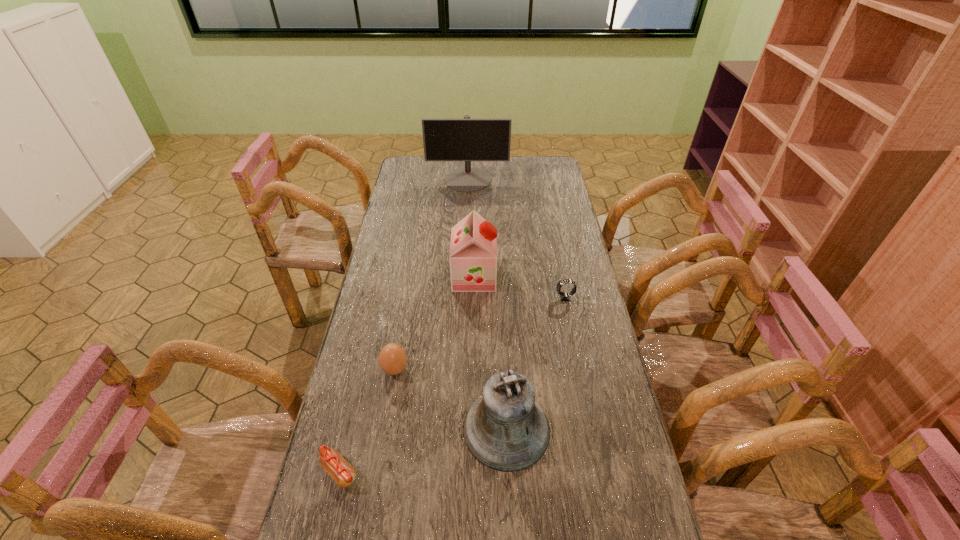
Identify the location of free spot between the watch and the second farthest object. (519, 287).

You are a GUI agent. You are given a task and a screenshot of the screen. Output one action in this format:
    pyautogui.click(x=<x>, y=<y>)
    Task: Click on the vacant space that is in between the watch and the soya milk
    
    Given the screenshot: What is the action you would take?
    pyautogui.click(x=519, y=287)

This screenshot has height=540, width=960. Identify the location of vacant space in between the sausage and the fifth nearest object. (407, 374).

The height and width of the screenshot is (540, 960). I want to click on free point between the bell and the fourth tallest object, so coord(451,399).

Locate an element on the screen. The height and width of the screenshot is (540, 960). free space between the shortest object and the bell is located at coordinates (x=423, y=450).

Where is `free space that is in between the fifth tallest object and the bell`? This screenshot has width=960, height=540. free space that is in between the fifth tallest object and the bell is located at coordinates (536, 363).

Identify the location of object that is the fourth closest to the second farthest object. The width and height of the screenshot is (960, 540). (466, 139).

The height and width of the screenshot is (540, 960). What are the coordinates of `object that is the fourth closest to the second farthest object` in the screenshot? It's located at (466, 139).

At what (x,y) coordinates should I click in order to perform the action: click on blank area in the image that satisfies the following two spatial constraints: 1. on the face of the rightmost object; 2. on the front side of the sausage. Please return your answer as a coordinate pair (x, y). This screenshot has height=540, width=960. Looking at the image, I should click on (599, 472).

This screenshot has height=540, width=960. Find the location of `free point that satisfies the following two spatial constraints: 1. with the cap open on the fifth nearest object; 2. on the left side of the bell`. free point that satisfies the following two spatial constraints: 1. with the cap open on the fifth nearest object; 2. on the left side of the bell is located at coordinates (471, 429).